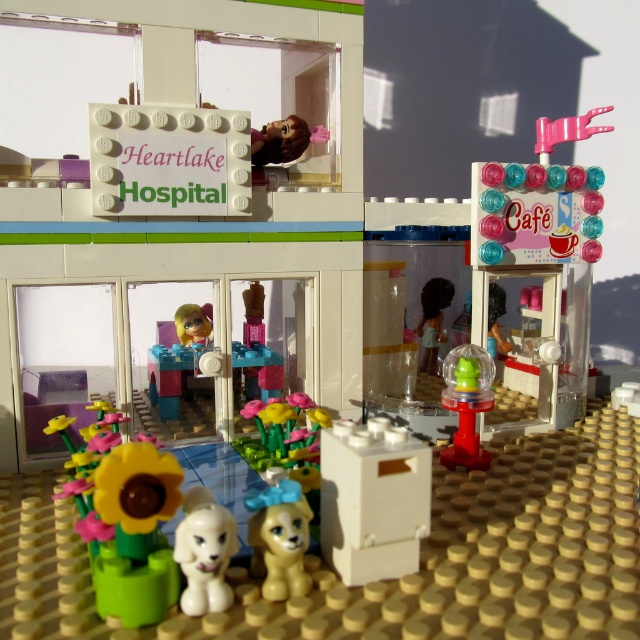
Who is positioned more to the left, floral-patterned plastic flowers at center or translucent plastic figure at center?

floral-patterned plastic flowers at center

Where is `floral-patterned plastic flowers at center`? Image resolution: width=640 pixels, height=640 pixels. floral-patterned plastic flowers at center is located at coordinates (282, 433).

Which is behind, point (273, 416) or point (449, 285)?

The point (449, 285) is behind.

Where is `floral-patterned plastic flowers at center`? This screenshot has width=640, height=640. floral-patterned plastic flowers at center is located at coordinates (282, 433).

Between translucent green plastic toy at center and translucent plastic figure at center, which one is positioned higher?

Positioned higher is translucent plastic figure at center.

Is translucent green plastic toy at center below translucent plastic figure at center?

Yes.

Where is `translucent green plastic toy at center`? This screenshot has height=640, width=640. translucent green plastic toy at center is located at coordinates (467, 404).

The image size is (640, 640). I want to click on translucent green plastic toy at center, so click(467, 404).

Can you confirm if translucent green plastic toy at center is smaller than matte plastic doll at center?

Indeed, translucent green plastic toy at center has a smaller size compared to matte plastic doll at center.

From the picture: Is translucent green plastic toy at center shorter than matte plastic doll at center?

Indeed, translucent green plastic toy at center has a lesser height compared to matte plastic doll at center.

Where is `translucent green plastic toy at center`? This screenshot has height=640, width=640. translucent green plastic toy at center is located at coordinates (467, 404).